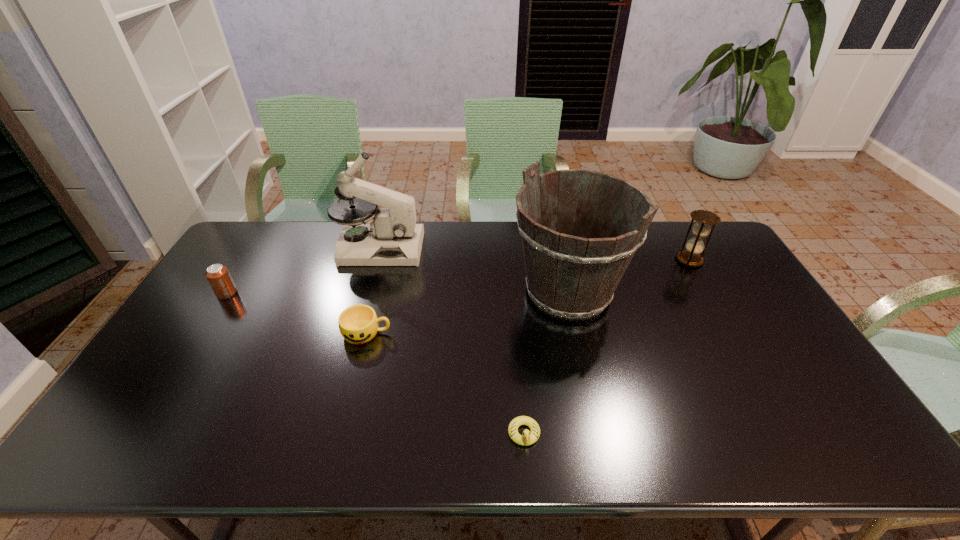
This screenshot has width=960, height=540. I want to click on vacant space located 0.380m at the eyepiece of the microscope, so click(x=528, y=248).

Where is `vacant region located on the left of the rightmost object`? This screenshot has width=960, height=540. vacant region located on the left of the rightmost object is located at coordinates (624, 260).

What are the coordinates of `vacant space located on the back of the leftmost object` in the screenshot? It's located at (256, 246).

The image size is (960, 540). In order to click on free region located on the left of the second shortest object in this screenshot , I will do `click(290, 333)`.

Identify the location of bucket that is at the far edge. (573, 268).

The image size is (960, 540). I want to click on microscope located at the far edge, so click(x=392, y=238).

Identify the location of hourglass located in the far edge section of the desktop. The width and height of the screenshot is (960, 540). (690, 257).

This screenshot has height=540, width=960. I want to click on object at the near edge, so click(528, 438).

Locate an element on the screen. The image size is (960, 540). object that is at the left edge is located at coordinates (218, 275).

The height and width of the screenshot is (540, 960). What are the coordinates of `object that is at the right edge` in the screenshot? It's located at (690, 257).